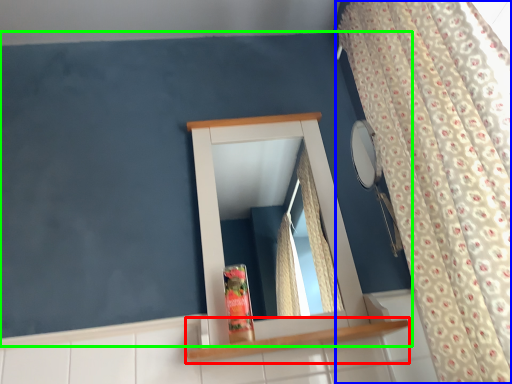
Question: Considering the real-world distances, which object is closest to shelf (highlighted by a red box)? curtain (highlighted by a blue box) or backdrop (highlighted by a green box).

Choices:
 (A) curtain
 (B) backdrop

Answer: (A)